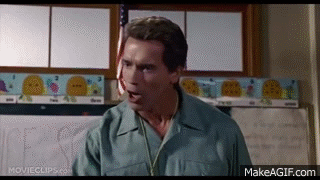
I want to click on cup, so click(289, 125).